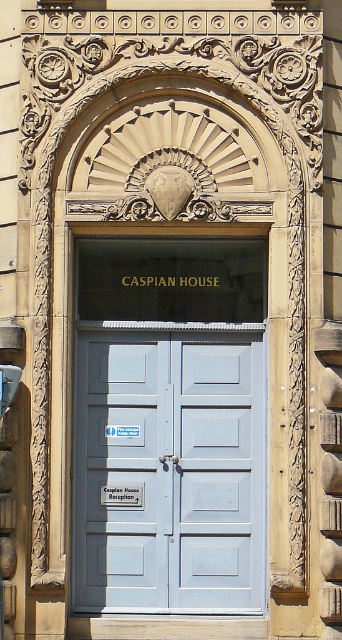
Question: Is light blue wood door at center below white plastic street sign at center?

Choices:
 (A) no
 (B) yes

Answer: (B)

Question: Can you confirm if light blue wood door at center is positioned below white plastic street sign at center?

Choices:
 (A) yes
 (B) no

Answer: (A)

Question: Which of the following is the closest to the observer?

Choices:
 (A) white plastic street sign at center
 (B) light blue wood door at center

Answer: (A)

Question: From the image, what is the correct spatial relationship of light blue wood door at center in relation to white plastic street sign at center?

Choices:
 (A) left
 (B) right

Answer: (B)

Question: Among these points, which one is farthest from the camera?

Choices:
 (A) (5, 401)
 (B) (234, 518)

Answer: (B)